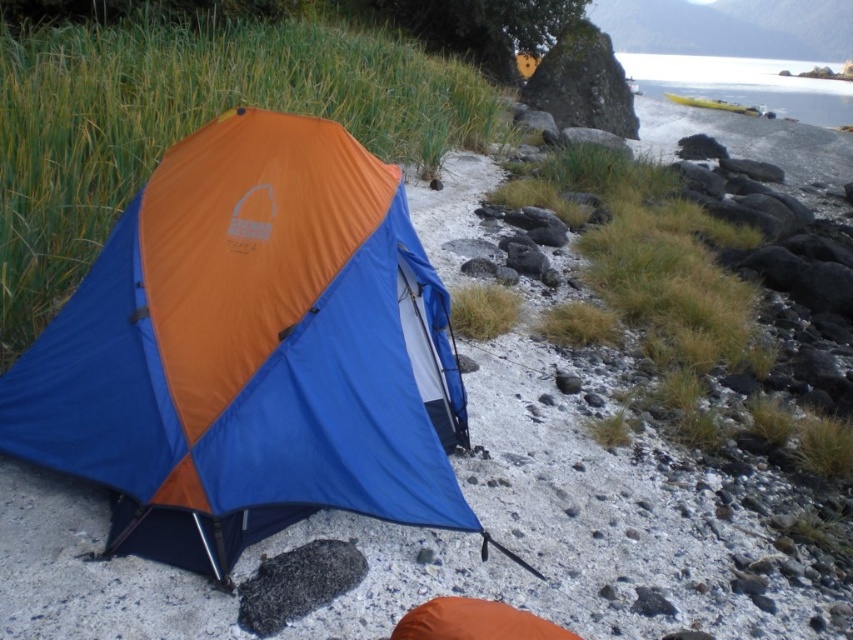
Question: Which point is farther from the camera taking this photo?

Choices:
 (A) (728, 106)
 (B) (433, 454)

Answer: (A)

Question: Can you confirm if orange fabric tent at center is positioned above yellow plastic kayak at upper right?

Choices:
 (A) yes
 (B) no

Answer: (B)

Question: From the image, what is the correct spatial relationship of orange fabric tent at center in relation to yellow plastic kayak at upper right?

Choices:
 (A) below
 (B) above

Answer: (A)

Question: Is orange fabric tent at center wider than yellow plastic kayak at upper right?

Choices:
 (A) no
 (B) yes

Answer: (A)